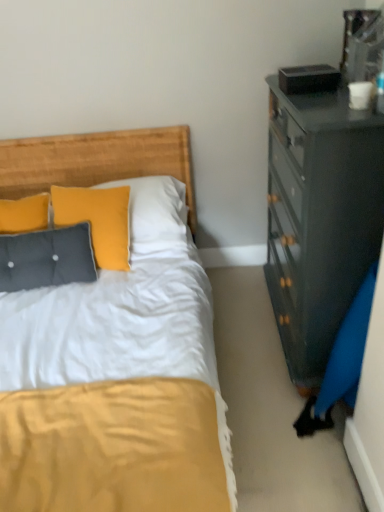
Measure the distance between wooden headboard at upper left and camera.

wooden headboard at upper left and camera are 7.77 feet apart.

Locate an element on the screen. The height and width of the screenshot is (512, 384). wooden headboard at upper left is located at coordinates (96, 161).

Describe the element at coordinates (96, 161) in the screenshot. I see `wooden headboard at upper left` at that location.

Find the location of a particular element. tufted fabric pillow at left is located at coordinates (46, 258).

The height and width of the screenshot is (512, 384). Describe the element at coordinates (46, 258) in the screenshot. I see `tufted fabric pillow at left` at that location.

Locate an element on the screen. This screenshot has width=384, height=512. wooden headboard at upper left is located at coordinates (96, 161).

Looking at this image, between tufted fabric pillow at left and wooden headboard at upper left, which one appears on the right side from the viewer's perspective?

Positioned to the right is wooden headboard at upper left.

Considering their positions, is tufted fabric pillow at left located in front of or behind wooden headboard at upper left?

tufted fabric pillow at left is positioned closer to the viewer than wooden headboard at upper left.

Does point (84, 270) appear closer or farther from the camera than point (42, 163)?

Point (84, 270) is closer to the camera than point (42, 163).

From the image's perspective, which one is positioned lower, tufted fabric pillow at left or wooden headboard at upper left?

From the image's view, tufted fabric pillow at left is below.

From a real-world perspective, relative to wooden headboard at upper left, is tufted fabric pillow at left vertically above or below?

tufted fabric pillow at left is below wooden headboard at upper left.

Considering the sizes of objects tufted fabric pillow at left and wooden headboard at upper left in the image provided, who is thinner, tufted fabric pillow at left or wooden headboard at upper left?

With smaller width is tufted fabric pillow at left.

In terms of height, does tufted fabric pillow at left look taller or shorter compared to wooden headboard at upper left?

Considering their sizes, tufted fabric pillow at left has less height than wooden headboard at upper left.

Is tufted fabric pillow at left bigger or smaller than wooden headboard at upper left?

Clearly, tufted fabric pillow at left is smaller in size than wooden headboard at upper left.

Can we say tufted fabric pillow at left lies outside wooden headboard at upper left?

Yes, tufted fabric pillow at left is outside of wooden headboard at upper left.

Can you see tufted fabric pillow at left touching wooden headboard at upper left?

They are not placed beside each other.

Is tufted fabric pillow at left positioned with its back to wooden headboard at upper left?

Yes, wooden headboard at upper left is at the back of tufted fabric pillow at left.

How many degrees apart are the facing directions of tufted fabric pillow at left and wooden headboard at upper left?

5.74 degrees separate the facing orientations of tufted fabric pillow at left and wooden headboard at upper left.

Looking at this image, how much distance is there between tufted fabric pillow at left and wooden headboard at upper left?

tufted fabric pillow at left and wooden headboard at upper left are 23.59 inches apart.

This screenshot has height=512, width=384. I want to click on headboard on the right of tufted fabric pillow at left, so click(96, 161).

Considering the positions of objects wooden headboard at upper left and tufted fabric pillow at left in the image provided, who is more to the right, wooden headboard at upper left or tufted fabric pillow at left?

wooden headboard at upper left.

Is wooden headboard at upper left behind tufted fabric pillow at left?

Yes, wooden headboard at upper left is further from the camera.

Which point is more forward, (103, 178) or (37, 275)?

The point (37, 275) is more forward.

From the image's perspective, is wooden headboard at upper left beneath tufted fabric pillow at left?

No.

From a real-world perspective, which object stands above the other?

wooden headboard at upper left.

Is wooden headboard at upper left wider or thinner than tufted fabric pillow at left?

Considering their sizes, wooden headboard at upper left looks broader than tufted fabric pillow at left.

In terms of height, does wooden headboard at upper left look taller or shorter compared to tufted fabric pillow at left?

In the image, wooden headboard at upper left appears to be taller than tufted fabric pillow at left.

Is wooden headboard at upper left bigger than tufted fabric pillow at left?

Yes.

Would you say wooden headboard at upper left is outside tufted fabric pillow at left?

Yes, wooden headboard at upper left is located beyond the bounds of tufted fabric pillow at left.

Is wooden headboard at upper left beside tufted fabric pillow at left?

No, wooden headboard at upper left is not next to tufted fabric pillow at left.

Is wooden headboard at upper left facing towards tufted fabric pillow at left?

Yes.

How distant is wooden headboard at upper left from tufted fabric pillow at left?

A distance of 23.59 inches exists between wooden headboard at upper left and tufted fabric pillow at left.

In the image, there is a wooden headboard at upper left. Where is `pillow below it (from the image's perspective)`? The image size is (384, 512). pillow below it (from the image's perspective) is located at coordinates (46, 258).

Locate an element on the screen. pillow that is under the wooden headboard at upper left (from a real-world perspective) is located at coordinates (46, 258).

Identify the location of headboard above the tufted fabric pillow at left (from the image's perspective). (96, 161).